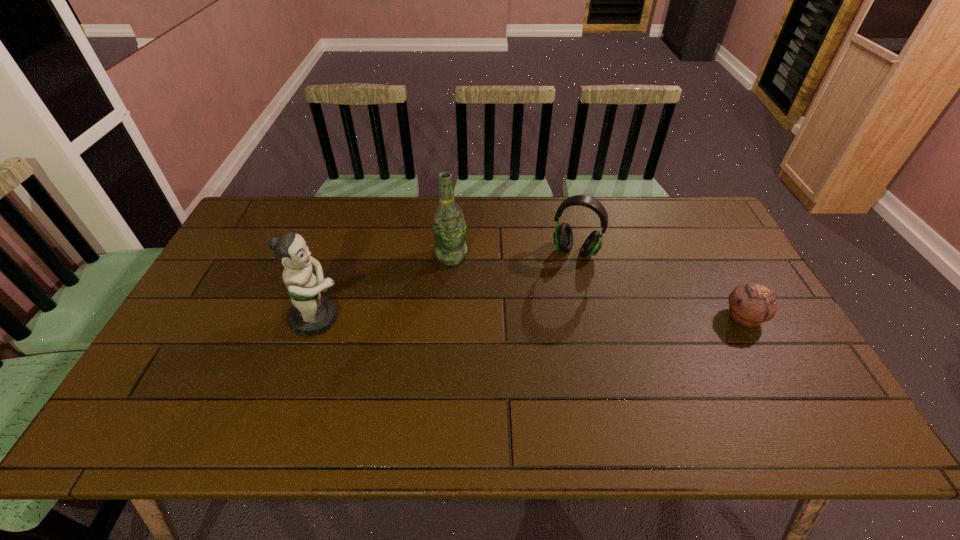
I want to click on vacant spot on the desktop that is between the leftmost object and the muffin and is positioned on the ear cups of the third object from left to right, so click(548, 318).

Locate an element on the screen. The image size is (960, 540). free spot on the desktop that is between the leftmost object and the shortest object and is positioned on the surface of the beer bottle is located at coordinates (472, 318).